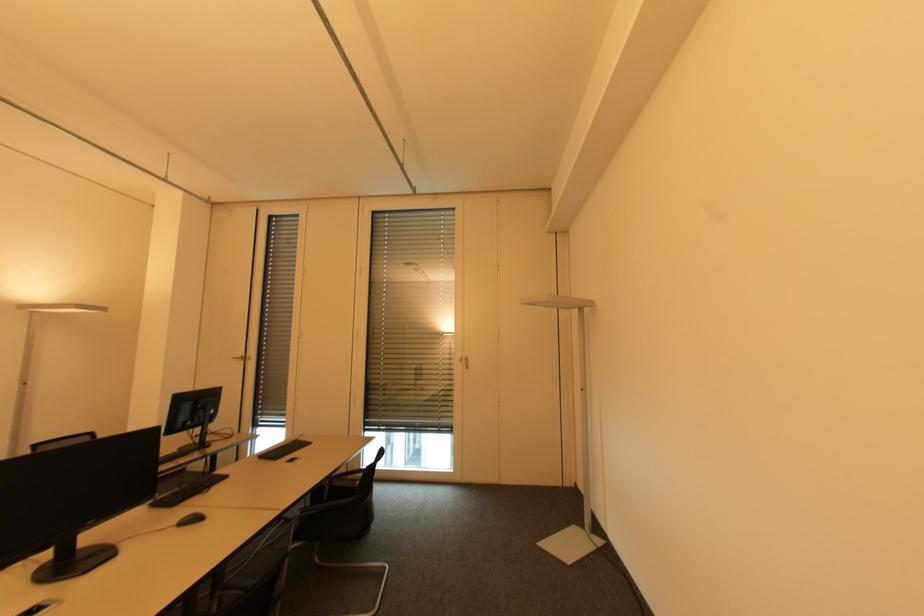
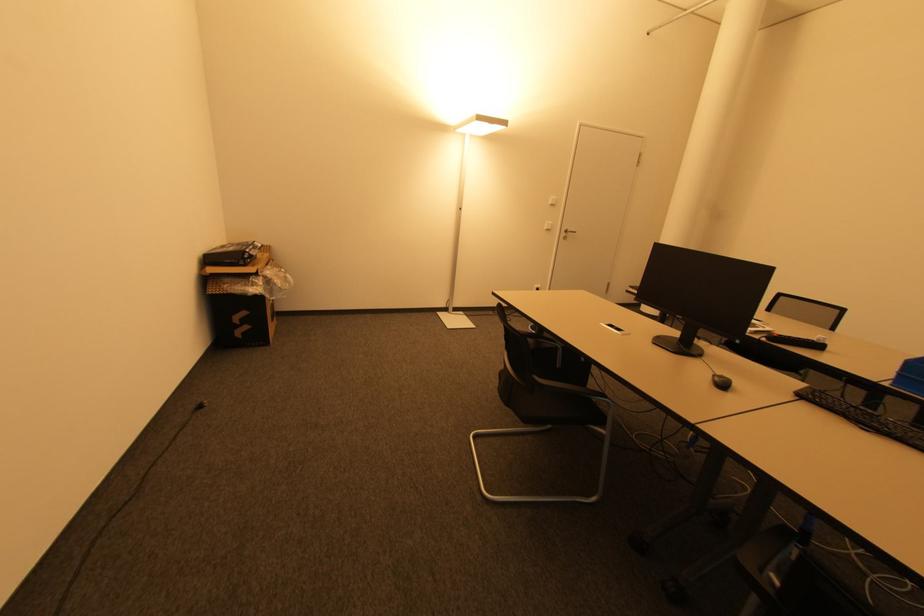
In the second image, find the point that corresponds to point (208, 493) in the first image.

(868, 430)